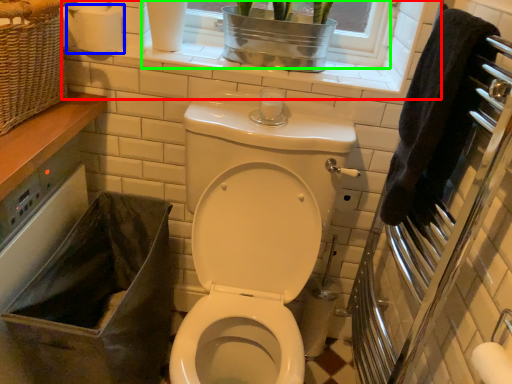
Question: Which object is the farthest from window frame (highlighted by a red box)? Choose among these: toilet paper (highlighted by a blue box) or window frame (highlighted by a green box).

Choices:
 (A) toilet paper
 (B) window frame

Answer: (A)